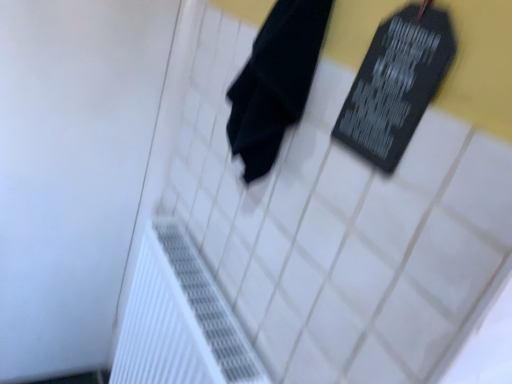
Question: Do you think black matte towel at center is within black matte board at upper right, or outside of it?

Choices:
 (A) outside
 (B) inside

Answer: (A)

Question: Based on their positions, is black matte towel at center located to the left or right of black matte board at upper right?

Choices:
 (A) right
 (B) left

Answer: (B)

Question: Which is farther from the black matte towel at center?

Choices:
 (A) white textured radiator at lower left
 (B) black matte board at upper right

Answer: (A)

Question: Which is nearer to the black matte towel at center?

Choices:
 (A) white textured radiator at lower left
 (B) black matte board at upper right

Answer: (B)